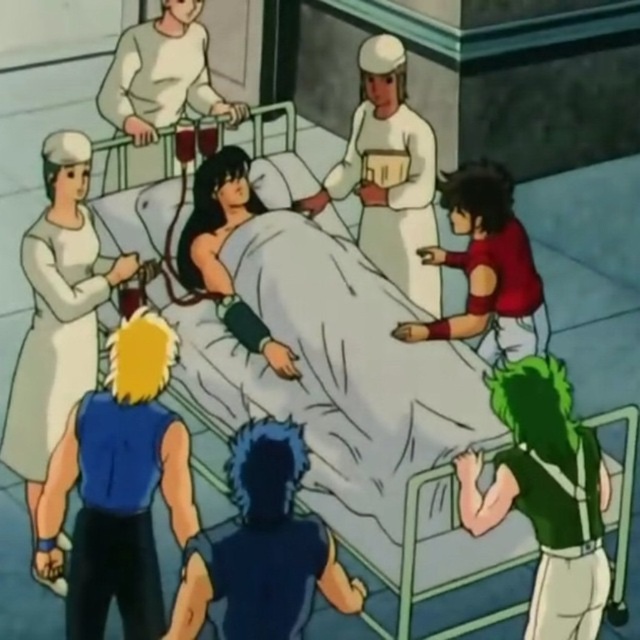
You are a nurse in the hospital room. You need to move a medical chart from the blue fabric shirt at left to the white matte uniform at center. Can you hand it directly without passing it to someone else?

The blue fabric shirt at left and white matte uniform at center are 6.49 feet apart from each other. Since the distance is more than an arm length, you cannot hand it directly and need to pass it through someone else.

You are a nurse in the hospital room and need to determine which of the two individuals is closer to the ceiling. The blue fabric shirt at left and the white matte uniform at center are both present. Which one is taller?

The blue fabric shirt at left is taller than the white matte uniform at center, so the blue fabric shirt at left is closer to the ceiling.